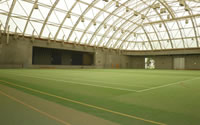
In order to click on corner wall most distant from camera in this screenshot , I will do `click(131, 62)`.